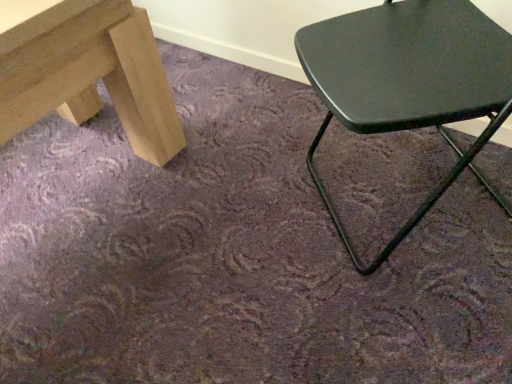
Describe the element at coordinates (409, 82) in the screenshot. I see `metallic green chair at right` at that location.

Where is `metallic green chair at right`? metallic green chair at right is located at coordinates (409, 82).

Locate an element on the screen. metallic green chair at right is located at coordinates (409, 82).